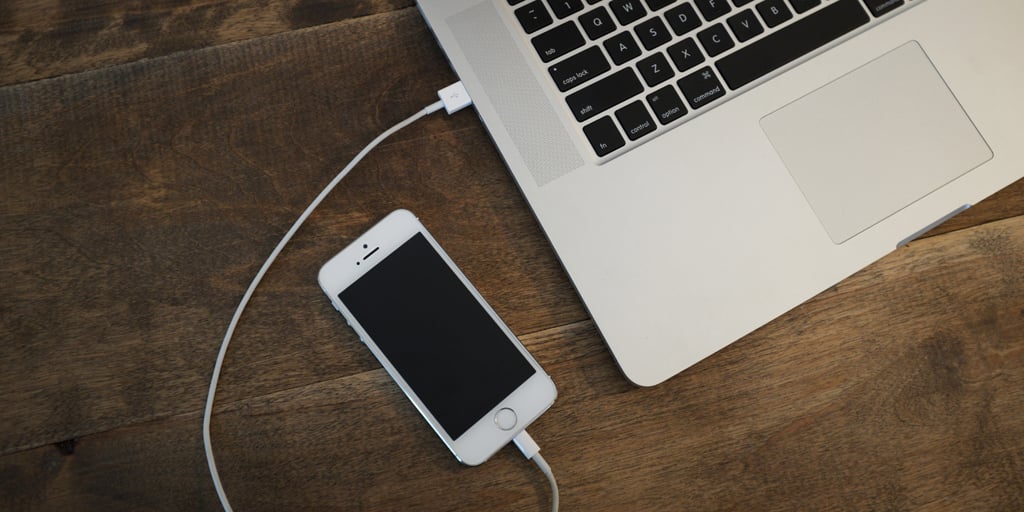
The image size is (1024, 512). Identify the location of laptop shadow. click(x=594, y=369), click(x=430, y=75).